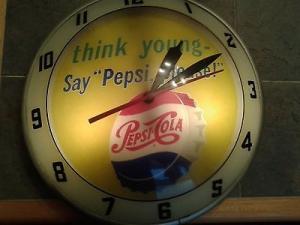
This screenshot has width=300, height=225. In order to click on wall in this screenshot , I will do `click(273, 147)`.